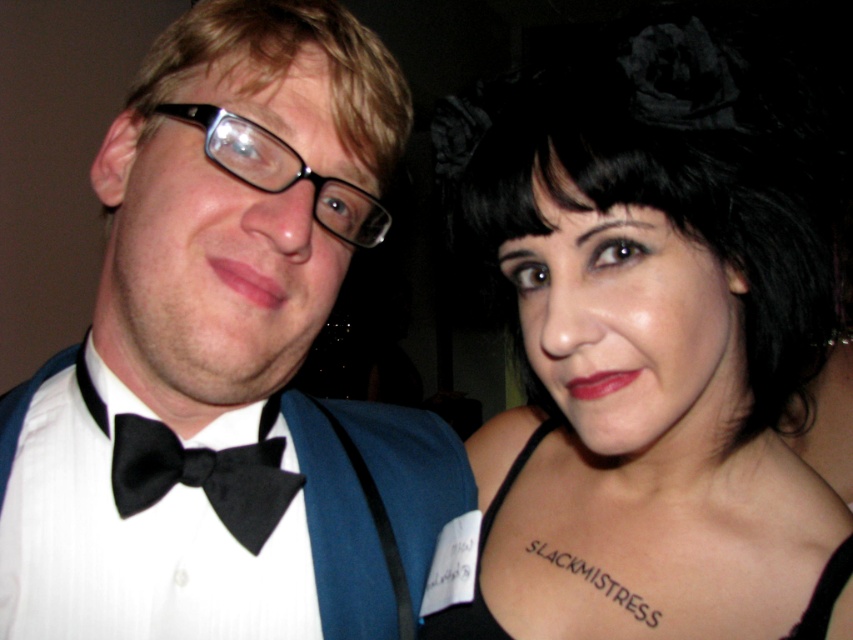
Question: Among these objects, which one is nearest to the camera?

Choices:
 (A) black plastic glasses at left
 (B) black satin bow tie at left

Answer: (A)

Question: In this image, where is white satin bow tie at center located relative to black matte hair at upper right?

Choices:
 (A) above
 (B) below

Answer: (B)

Question: Is white satin bow tie at center thinner than black satin bow tie at left?

Choices:
 (A) no
 (B) yes

Answer: (A)

Question: Which object is positioned farthest from the white satin bow tie at center?

Choices:
 (A) black matte hair at upper right
 (B) black fabric dress at center
 (C) black satin bow tie at left

Answer: (B)

Question: Which object is positioned farthest from the black fabric dress at center?

Choices:
 (A) black matte hair at upper right
 (B) black satin bow tie at left
 (C) white satin bow tie at center
 (D) black plastic glasses at left

Answer: (D)

Question: Is white satin bow tie at center bigger than black fabric dress at center?

Choices:
 (A) yes
 (B) no

Answer: (A)